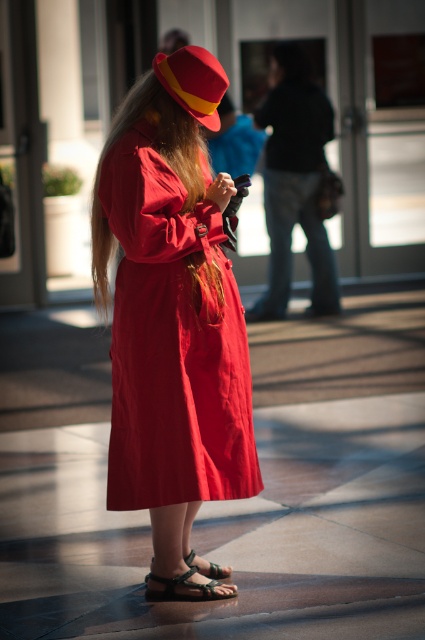
Consider the image. Does shiny golden hair at center appear under green woven sandal at lower center?

No, shiny golden hair at center is not below green woven sandal at lower center.

Looking at this image, can you confirm if shiny golden hair at center is taller than green woven sandal at lower center?

Indeed, shiny golden hair at center has a greater height compared to green woven sandal at lower center.

This screenshot has height=640, width=425. What do you see at coordinates (99, 179) in the screenshot?
I see `shiny golden hair at center` at bounding box center [99, 179].

Identify the location of shiny golden hair at center. This screenshot has width=425, height=640. pos(99,179).

In the scene shown: Is matte red dress at center positioned at the back of green woven sandal at lower center?

No, matte red dress at center is in front of green woven sandal at lower center.

Does matte red dress at center have a smaller size compared to green woven sandal at lower center?

Actually, matte red dress at center might be larger than green woven sandal at lower center.

Where is `matte red dress at center`? matte red dress at center is located at coordinates (172, 340).

Can you confirm if matte red dress at center is positioned to the right of matte red and yellow hat at upper center?

Incorrect, matte red dress at center is not on the right side of matte red and yellow hat at upper center.

How much distance is there between matte red dress at center and matte red and yellow hat at upper center?

matte red dress at center is 1.10 meters from matte red and yellow hat at upper center.

Which is behind, point (121, 160) or point (201, 100)?

Point (201, 100)

The image size is (425, 640). In order to click on matte red dress at center in this screenshot , I will do `click(172, 340)`.